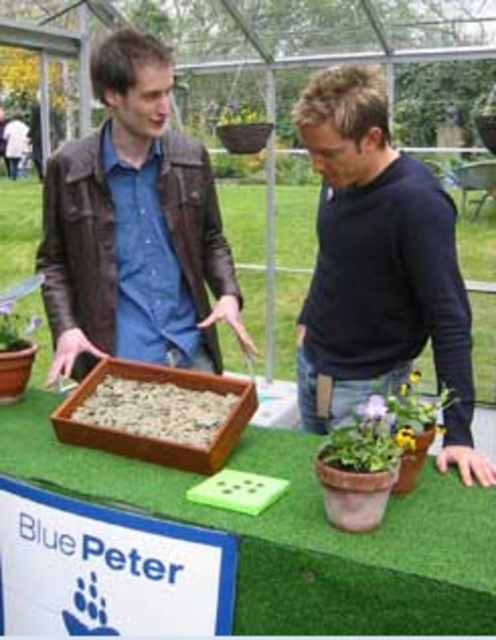
You are standing at the point with coordinates point (372,419) and want to walk to the point with coordinates point (186,362). Which direction should you move in to reach your destination?

You should move north to reach point (186,362) from point (372,419) because the first point is behind the second point, indicating a northerly direction.

You are a photographer trying to capture a clear shot of both the brown leather jacket at center and the matte brown pot at lower center. Since you want both subjects to be fully visible in the frame, would adjusting the camera angle upwards help in this scenario?

The brown leather jacket at center is taller than the matte brown pot at lower center. By angling the camera upwards, you can ensure both subjects are fully visible as the taller jacket will not block the shorter pot.

You are a photographer trying to capture a photo of the brown leather jacket at center and the matte brown pot at lower center. If you want to ensure both objects are fully visible in the frame without cropping, which object requires more horizontal space in the camera frame?

The brown leather jacket at center might require more horizontal space in the camera frame because it might be wider than the matte brown pot at lower center.